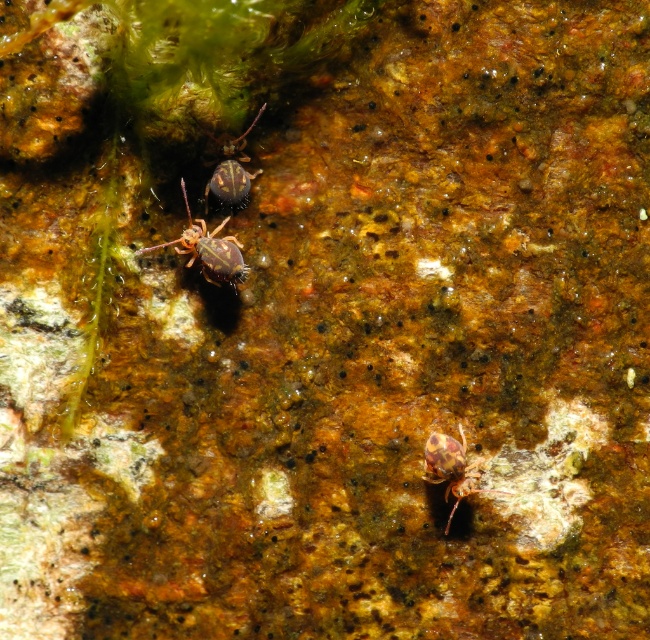
Can you confirm if brown textured spider at center is thinner than brown spotted spider at center?

No, brown textured spider at center is not thinner than brown spotted spider at center.

Is point (192, 218) closer to camera compared to point (502, 490)?

No, it is not.

Is point (136, 250) in front of point (434, 456)?

No, (136, 250) is further to viewer.

At what (x,y) coordinates should I click in order to perform the action: click on brown textured spider at center. Please return your answer as a coordinate pair (x, y). Looking at the image, I should click on (209, 250).

Does brown spotted spider at center have a lesser height compared to shiny brown spider at center?

Indeed, brown spotted spider at center has a lesser height compared to shiny brown spider at center.

Which of these two, brown spotted spider at center or shiny brown spider at center, stands taller?

Standing taller between the two is shiny brown spider at center.

Who is more forward, (x=478, y=474) or (x=229, y=136)?

Point (x=478, y=474)

The width and height of the screenshot is (650, 640). Identify the location of brown spotted spider at center. (450, 468).

Which is more to the right, brown textured spider at center or shiny brown spider at center?

From the viewer's perspective, shiny brown spider at center appears more on the right side.

Which is behind, point (177, 243) or point (239, 177)?

Positioned behind is point (239, 177).

Is point (237, 259) behind point (254, 172)?

No, it is in front of (254, 172).

Image resolution: width=650 pixels, height=640 pixels. In order to click on brown textured spider at center in this screenshot , I will do `click(209, 250)`.